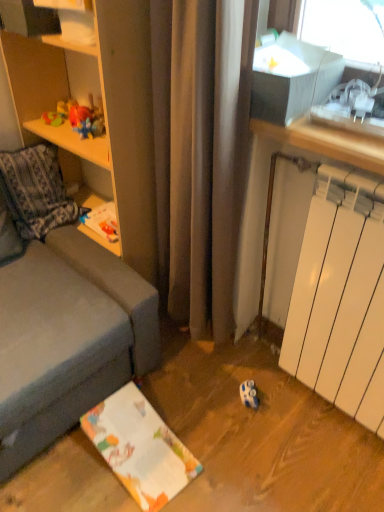
Question: Is wooden shelf at left surrounded by white matte radiator at lower right?

Choices:
 (A) yes
 (B) no

Answer: (B)

Question: Considering the relative sizes of white matte radiator at lower right and wooden shelf at left in the image provided, is white matte radiator at lower right wider than wooden shelf at left?

Choices:
 (A) no
 (B) yes

Answer: (A)

Question: Can you confirm if white matte radiator at lower right is shorter than wooden shelf at left?

Choices:
 (A) yes
 (B) no

Answer: (A)

Question: From the image's perspective, is white matte radiator at lower right over wooden shelf at left?

Choices:
 (A) yes
 (B) no

Answer: (B)

Question: From a real-world perspective, is white matte radiator at lower right over wooden shelf at left?

Choices:
 (A) no
 (B) yes

Answer: (A)

Question: Visually, is wooden shelf at left positioned to the left or to the right of plush orange bear at upper left?

Choices:
 (A) left
 (B) right

Answer: (B)

Question: Choose the correct answer: Is wooden shelf at left inside plush orange bear at upper left or outside it?

Choices:
 (A) outside
 (B) inside

Answer: (A)

Question: Relative to plush orange bear at upper left, is wooden shelf at left in front or behind?

Choices:
 (A) behind
 (B) front

Answer: (B)

Question: Looking at their shapes, would you say wooden shelf at left is wider or thinner than plush orange bear at upper left?

Choices:
 (A) wide
 (B) thin

Answer: (A)

Question: From the image's perspective, relative to wooden shelf at left, is white matte radiator at lower right above or below?

Choices:
 (A) below
 (B) above

Answer: (A)

Question: In the image, is white matte radiator at lower right positioned in front of or behind wooden shelf at left?

Choices:
 (A) front
 (B) behind

Answer: (A)

Question: In the image, is white matte radiator at lower right on the left side or the right side of wooden shelf at left?

Choices:
 (A) left
 (B) right

Answer: (B)

Question: From a real-world perspective, is white matte radiator at lower right above or below wooden shelf at left?

Choices:
 (A) above
 (B) below

Answer: (B)

Question: Considering the relative positions of white glossy shelf at upper left and white matte radiator at lower right in the image provided, is white glossy shelf at upper left to the left or to the right of white matte radiator at lower right?

Choices:
 (A) right
 (B) left

Answer: (B)

Question: Does point (29, 3) appear closer or farther from the camera than point (382, 274)?

Choices:
 (A) closer
 (B) farther

Answer: (B)